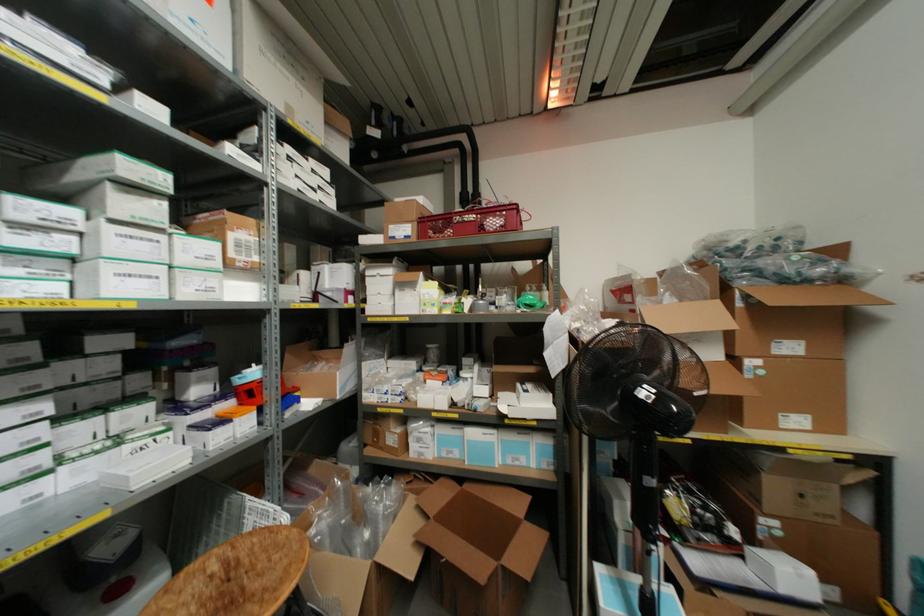
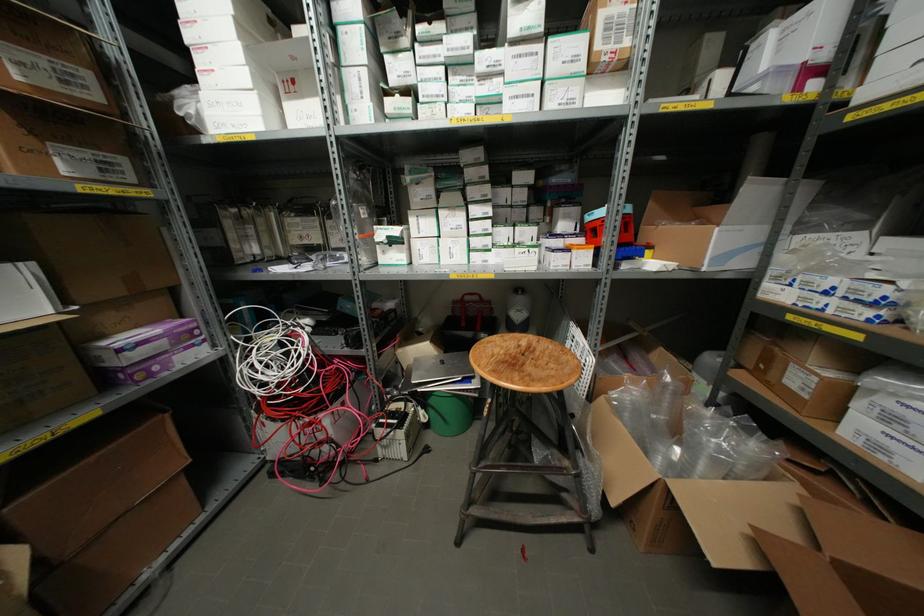
The point at (225, 565) is marked in the first image. Where is the corresponding point in the second image?

(529, 347)